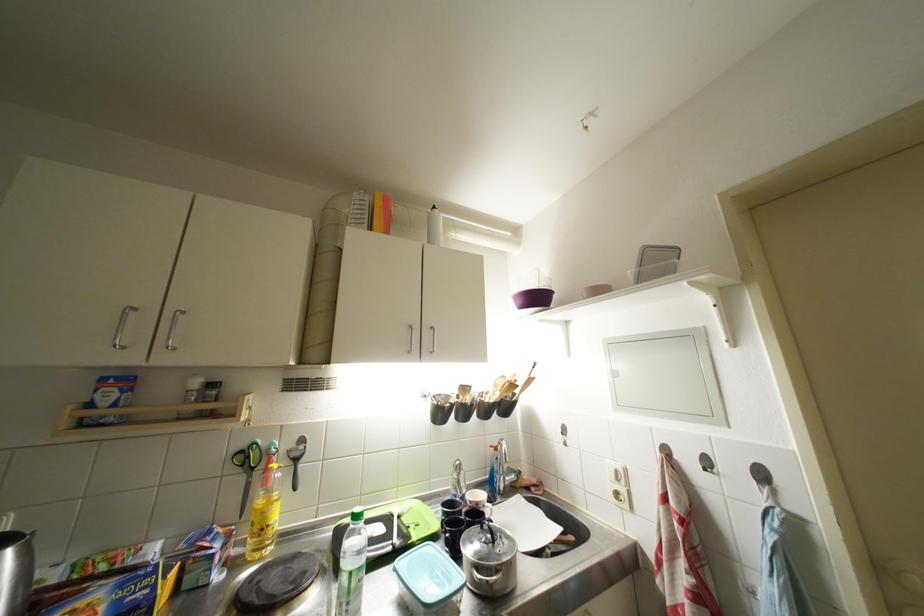
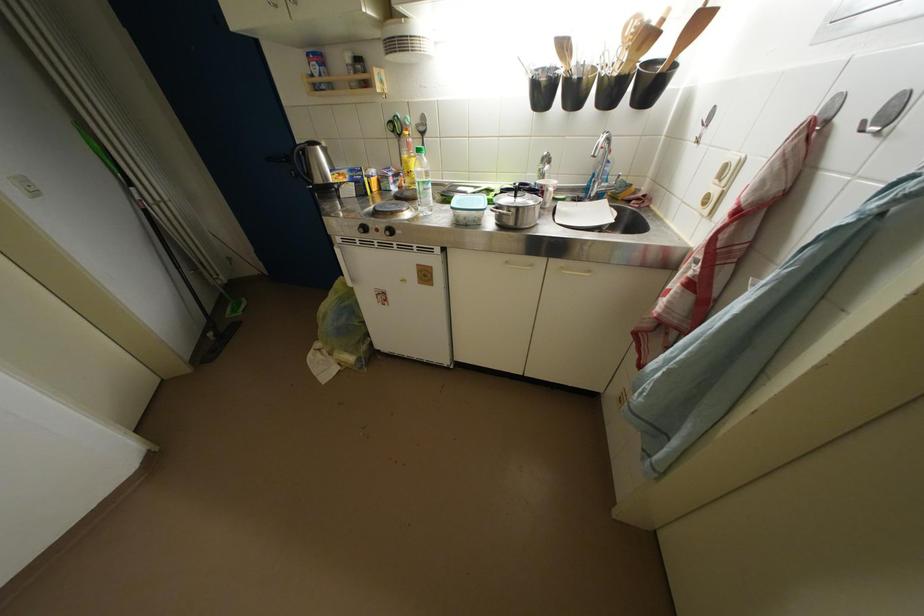
Where in the second image is the point corresponding to point (271, 517) from the first image?

(412, 167)